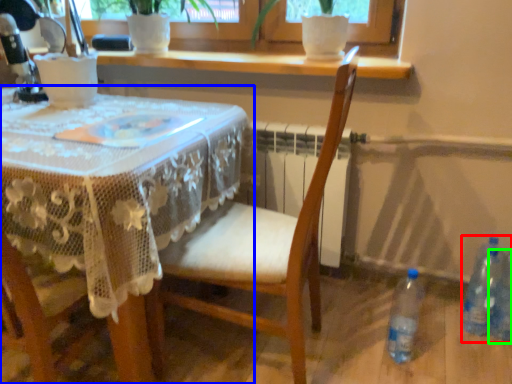
Question: Which is farther away from bottle (highlighted by a red box)? table (highlighted by a blue box) or bottle (highlighted by a green box)?

Choices:
 (A) table
 (B) bottle

Answer: (A)